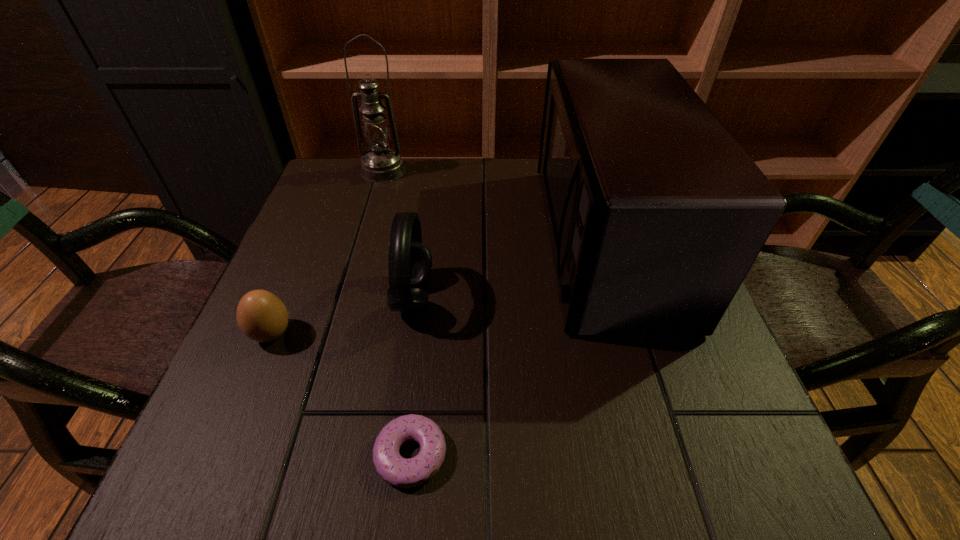
The width and height of the screenshot is (960, 540). Find the location of `oil lamp`. oil lamp is located at coordinates (381, 164).

The width and height of the screenshot is (960, 540). Identify the location of the rightmost object. (656, 214).

Locate an element on the screen. the third tallest object is located at coordinates (410, 261).

This screenshot has height=540, width=960. I want to click on boiled egg, so click(x=261, y=316).

Identify the location of the second shortest object. (261, 316).

Locate an element on the screen. doughnut is located at coordinates (394, 469).

Image resolution: width=960 pixels, height=540 pixels. In order to click on the shortest object in this screenshot , I will do `click(394, 469)`.

I want to click on free point located 0.330m on the right of the oil lamp, so click(532, 171).

At what (x,y) coordinates should I click in order to perform the action: click on vacant space located on the front-facing side of the rightmost object. Please return your answer as a coordinate pair (x, y). This screenshot has width=960, height=540. Looking at the image, I should click on (446, 241).

Locate an element on the screen. This screenshot has height=540, width=960. vacant space located 0.250m on the front-facing side of the rightmost object is located at coordinates (427, 241).